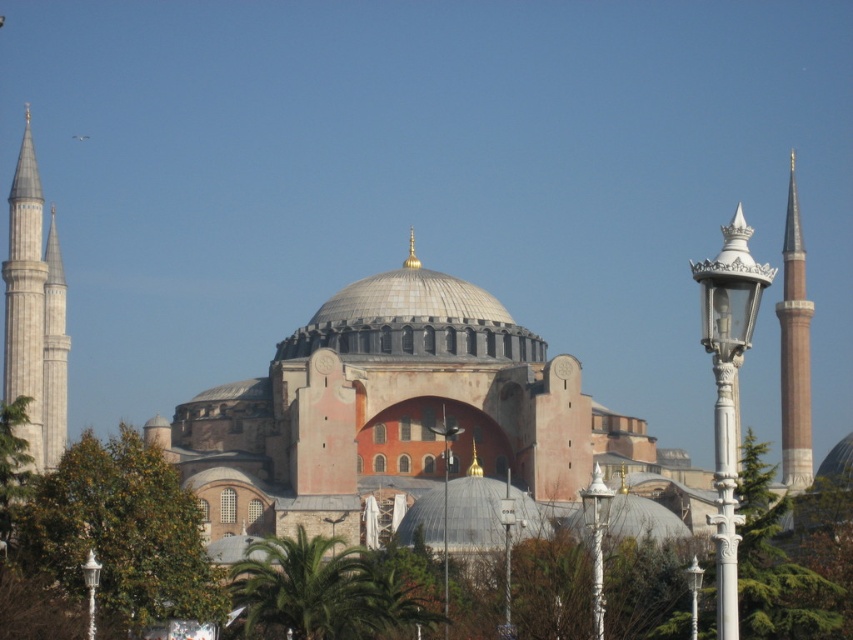
You are standing at the entrance of the Hagia Sophia and see the point marked at coordinates (120, 534). What object is located at that point?

The point at coordinates (120, 534) indicates a green leafy tree at lower left.

You are standing in front of the Hagia Sophia and want to take a photo that includes both the central dome of the Hagia Sophia and the green leafy tree at lower left. Given that the tree is 86.82 meters away from you, is it possible to capture both in the same frame without moving your position?

The green leafy tree at lower left is 86.82 meters from the viewer. Since the central dome of the Hagia Sophia is part of the main building which is likely closer than 86.82 meters, it should be possible to capture both in the same frame as long as the camera lens has an appropriate angle of view.

Consider the image. You are standing in front of the Hagia Sophia and want to take a photo that includes both the central dome and the green leafy tree at lower left. Based on their positions, will the tree be to the left or right of the dome in the photo?

The green leafy tree at lower left is located at point (120, 534), which means it is positioned to the left of the central dome in the photo.